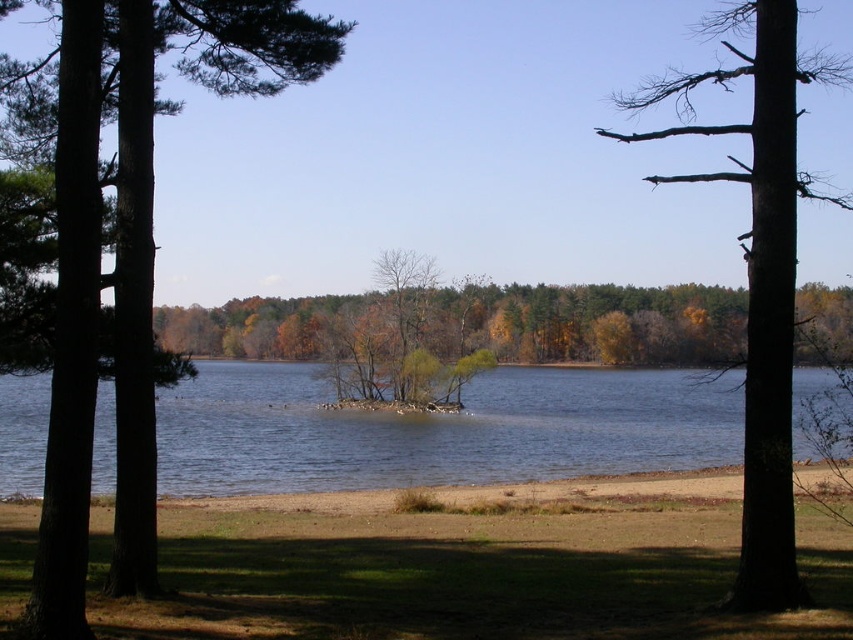
Between clear blue water at center and brown rough bark tree at right, which one appears on the left side from the viewer's perspective?

Positioned to the left is clear blue water at center.

Is clear blue water at center above brown rough bark tree at right?

No, clear blue water at center is not above brown rough bark tree at right.

Based on the photo, measure the distance between point (6, 486) and camera.

They are 154.97 feet apart.

What are the coordinates of `clear blue water at center` in the screenshot? It's located at (439, 429).

Is the position of green matte tree at left more distant than that of brown rough bark tree at right?

That is False.

Is green matte tree at left shorter than brown rough bark tree at right?

Correct, green matte tree at left is not as tall as brown rough bark tree at right.

Describe the element at coordinates (109, 240) in the screenshot. Image resolution: width=853 pixels, height=640 pixels. I see `green matte tree at left` at that location.

Find the location of a particular element. green matte tree at left is located at coordinates (109, 240).

Does point (10, 182) come closer to viewer compared to point (320, 461)?

Yes, it is in front of point (320, 461).

Does green matte tree at left come behind clear blue water at center?

No, green matte tree at left is in front of clear blue water at center.

Where is `green matte tree at left`? Image resolution: width=853 pixels, height=640 pixels. green matte tree at left is located at coordinates (109, 240).

This screenshot has width=853, height=640. Find the location of `green matte tree at left`. green matte tree at left is located at coordinates (109, 240).